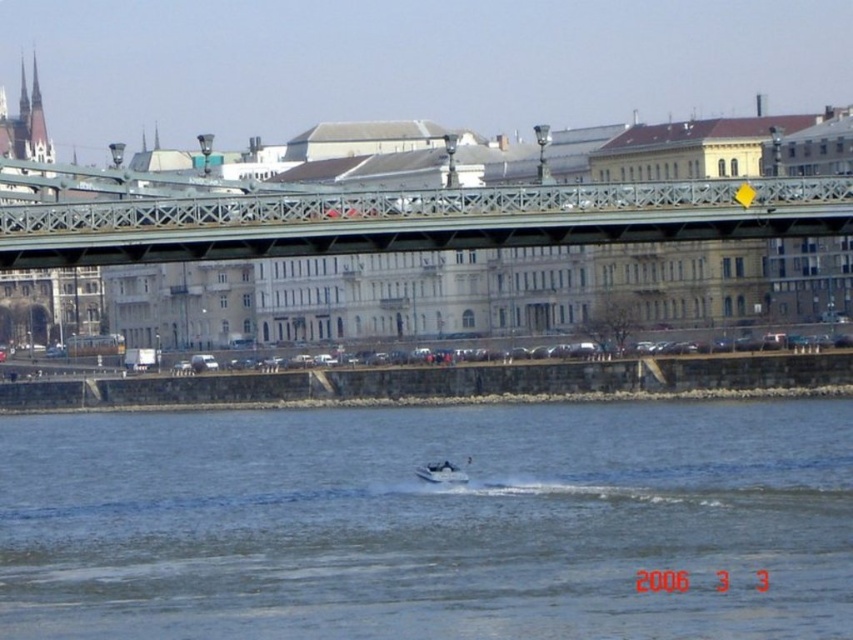
You are a photographer planning to capture the entire scene of the clear water at center and the white plastic boat at center in one shot. Given that your camera has a fixed focal length, which object should you focus on to ensure both are in frame without cropping?

Since the clear water at center is bigger than the white plastic boat at center, you should focus on the clear water at center to ensure both objects are fully captured in the frame without cropping.

In the scene shown: You are a photographer planning to capture the white plastic boat at center and the metallic bridge at center in the same frame. Based on their positions, which object will appear larger in the photo?

The metallic bridge at center will appear larger in the photo because it is much taller than the white plastic boat at center.